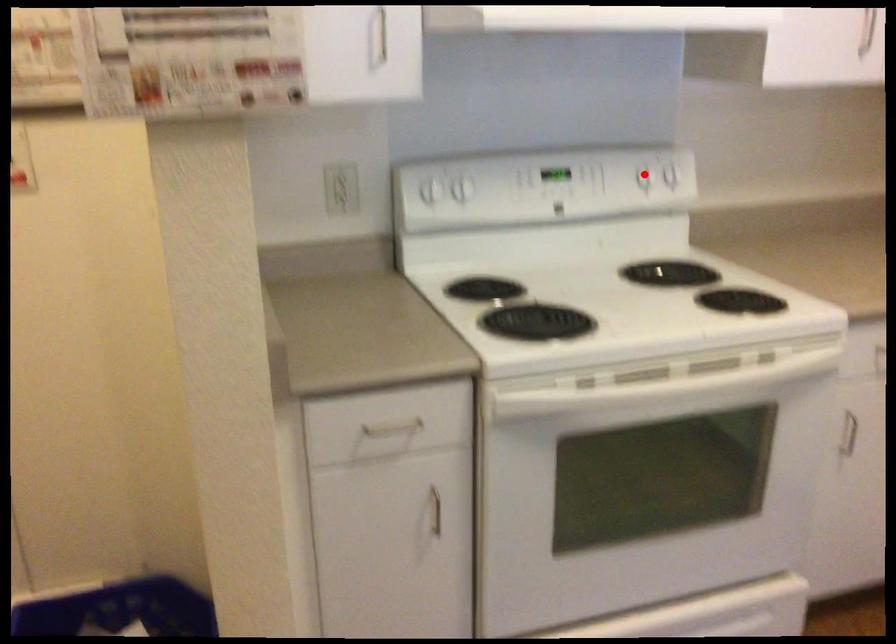
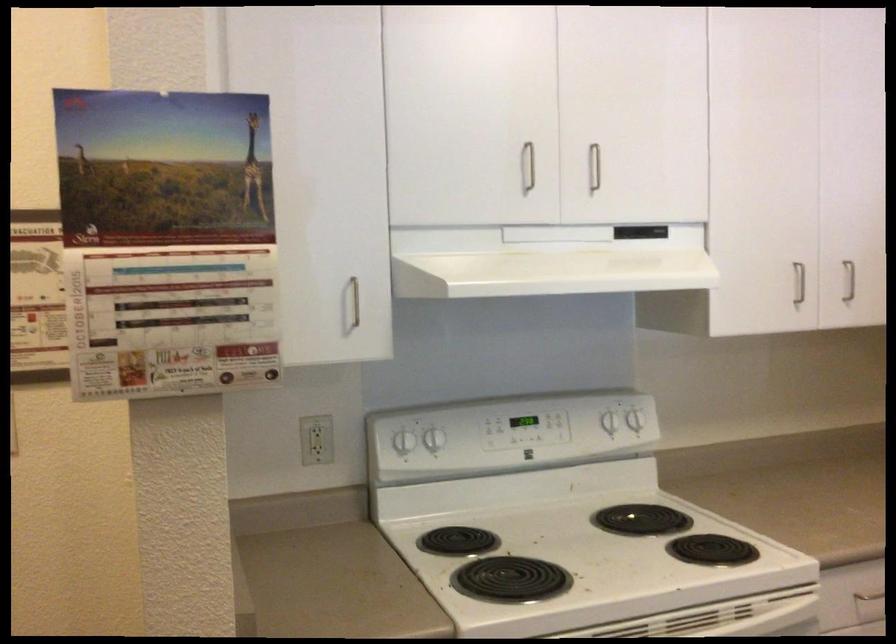
In the second image, find the point that corresponds to the highlighted location in the first image.

(608, 422)